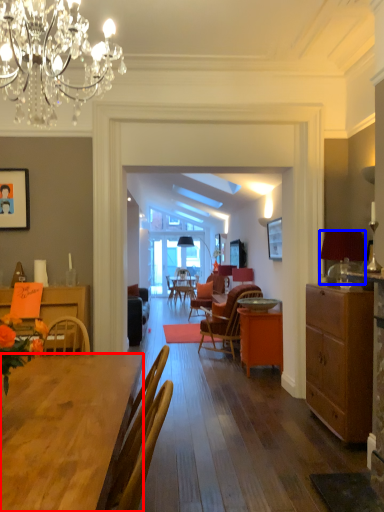
Question: Which object is closer to the camera taking this photo, desk (highlighted by a red box) or lamp (highlighted by a blue box)?

Choices:
 (A) desk
 (B) lamp

Answer: (A)